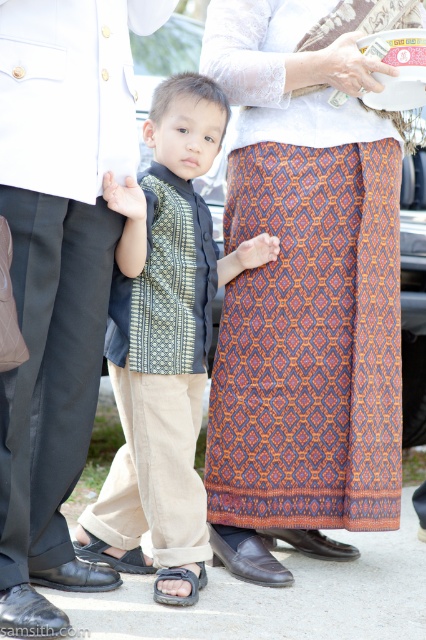
In the scene shown: Is matte black suit at center behind matte green batik hand at center?

No, it is in front of matte green batik hand at center.

Measure the distance between point (28, 93) and camera.

A distance of 8.10 feet exists between point (28, 93) and camera.

Locate an element on the screen. The image size is (426, 640). matte black suit at center is located at coordinates (58, 272).

This screenshot has width=426, height=640. Identify the location of patterned fabric skirt at center. (302, 305).

From the picture: Which is more to the left, patterned fabric skirt at center or matte black suit at center?

matte black suit at center

This screenshot has width=426, height=640. Identify the location of patterned fabric skirt at center. (302, 305).

Between patterned fabric skirt at center and matte green batik hand at center, which one has more height?

Standing taller between the two is patterned fabric skirt at center.

Is patterned fabric skirt at center thinner than matte green batik hand at center?

No, patterned fabric skirt at center is not thinner than matte green batik hand at center.

Describe the element at coordinates (302, 305) in the screenshot. I see `patterned fabric skirt at center` at that location.

Where is `patterned fabric skirt at center`? Image resolution: width=426 pixels, height=640 pixels. patterned fabric skirt at center is located at coordinates (302, 305).